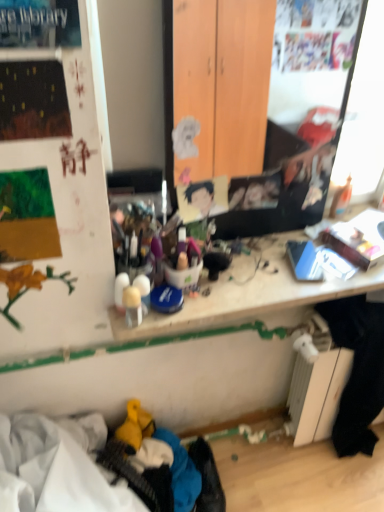
Question: Should I look upward or downward to see smooth cardboard portrait at center?

Choices:
 (A) up
 (B) down

Answer: (A)

Question: Is the surface of smooth cardboard portrait at center in direct contact with black fabric at lower right?

Choices:
 (A) no
 (B) yes

Answer: (A)

Question: From the image's perspective, is smooth cardboard portrait at center located above black fabric at lower right?

Choices:
 (A) no
 (B) yes

Answer: (B)

Question: Is smooth cardboard portrait at center further to camera compared to black fabric at lower right?

Choices:
 (A) yes
 (B) no

Answer: (B)

Question: Is smooth cardboard portrait at center facing away from black fabric at lower right?

Choices:
 (A) yes
 (B) no

Answer: (B)

Question: Is smooth cardboard portrait at center not within black fabric at lower right?

Choices:
 (A) yes
 (B) no

Answer: (A)

Question: Is smooth cardboard portrait at center far away from black fabric at lower right?

Choices:
 (A) no
 (B) yes

Answer: (A)

Question: Is wooden desk at center bigger than smooth cardboard portrait at center?

Choices:
 (A) no
 (B) yes

Answer: (B)

Question: From the image's perspective, is wooden desk at center below smooth cardboard portrait at center?

Choices:
 (A) no
 (B) yes

Answer: (B)

Question: Is smooth cardboard portrait at center surrounded by wooden desk at center?

Choices:
 (A) no
 (B) yes

Answer: (A)

Question: Is wooden desk at center aimed at smooth cardboard portrait at center?

Choices:
 (A) no
 (B) yes

Answer: (A)

Question: Is wooden desk at center next to smooth cardboard portrait at center?

Choices:
 (A) yes
 (B) no

Answer: (B)

Question: Considering the relative sizes of wooden desk at center and smooth cardboard portrait at center in the image provided, is wooden desk at center taller than smooth cardboard portrait at center?

Choices:
 (A) no
 (B) yes

Answer: (A)

Question: Is black fabric at lower right positioned with its back to smooth cardboard portrait at center?

Choices:
 (A) no
 (B) yes

Answer: (A)